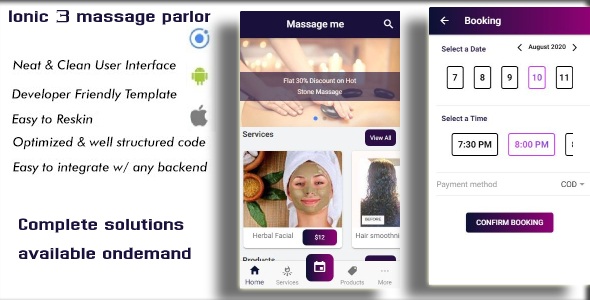
Image resolution: width=590 pixels, height=300 pixels. I want to click on white towel, so click(x=334, y=160).